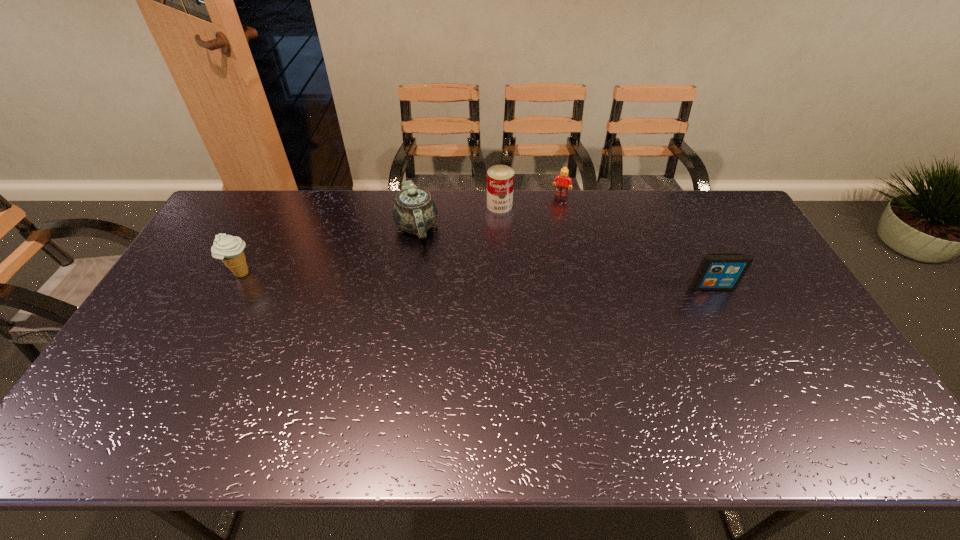
This screenshot has width=960, height=540. Identify the location of object present at the right edge. (717, 271).

You are a GUI agent. You are given a task and a screenshot of the screen. Output one action in this format:
    pyautogui.click(x=<x>, y=<y>)
    Task: Click on the vacant space at the far edge of the desktop
    
    Given the screenshot: What is the action you would take?
    pyautogui.click(x=276, y=198)

Image resolution: width=960 pixels, height=540 pixels. Find the location of `vacant position at the near edge of the desktop`. vacant position at the near edge of the desktop is located at coordinates (709, 383).

This screenshot has width=960, height=540. What are the coordinates of `vacant area at the left edge` in the screenshot? It's located at (173, 369).

Identify the location of free point at the right edge. The height and width of the screenshot is (540, 960). (800, 340).

The image size is (960, 540). I want to click on free space at the far right corner of the desktop, so click(x=707, y=197).

The height and width of the screenshot is (540, 960). I want to click on free spot between the iPod and the second object from left to right, so click(564, 257).

Find the location of a particular element. The width and height of the screenshot is (960, 540). empty space between the chinaware and the icecream is located at coordinates (329, 251).

Find the location of a particular element. Image resolution: width=960 pixels, height=540 pixels. free spot between the leftmost object and the iPod is located at coordinates (477, 281).

Identify the location of free space that is in between the rightmost object and the icecream. (477, 281).